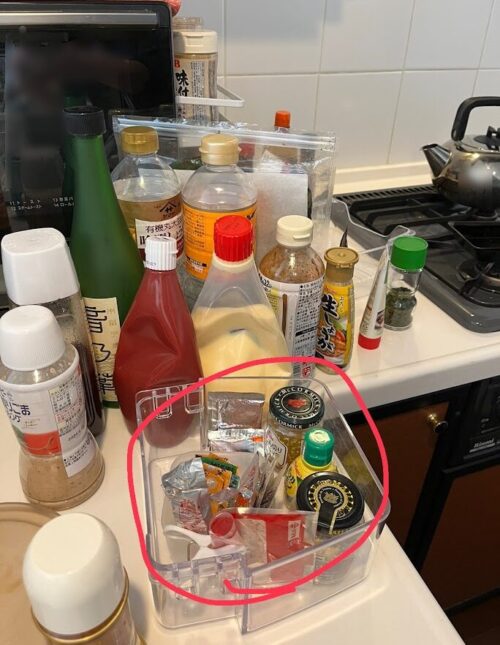
Find the location of `stovetop`. stovetop is located at coordinates (438, 240).